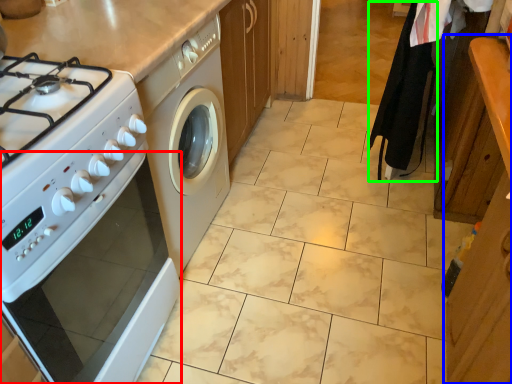
Question: Estimate the real-world distances between objects in this image. Which object is closer to oven (highlighted by a red box), cabinetry (highlighted by a blue box) or robe (highlighted by a green box)?

Choices:
 (A) cabinetry
 (B) robe

Answer: (A)